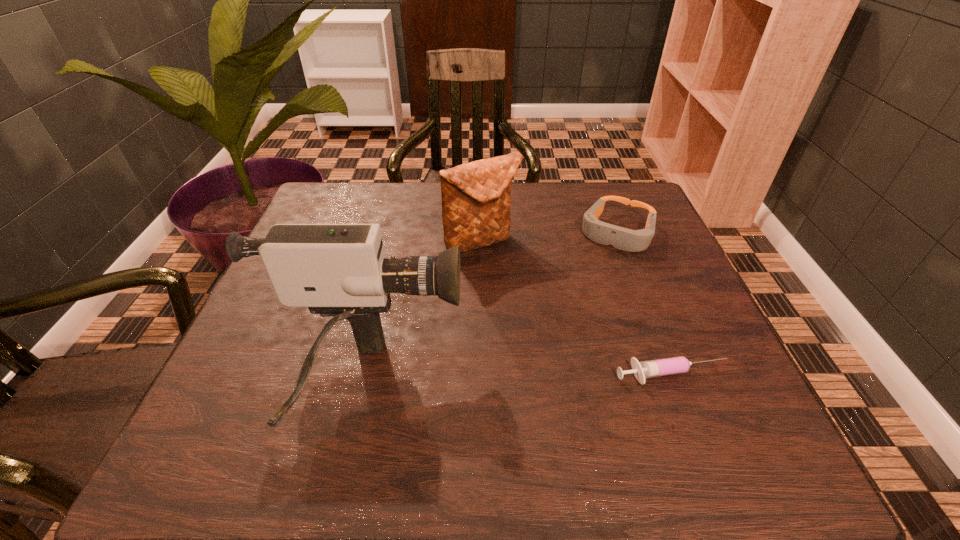
Where is `vacant space on the desktop that is between the camcorder and the syringe and is positioned on the open side of the clutch bag`? vacant space on the desktop that is between the camcorder and the syringe and is positioned on the open side of the clutch bag is located at coordinates 565,378.

This screenshot has width=960, height=540. Find the location of `vacant spot on the desktop that is between the camcorder and the syringe and is positioned on the front and back of the second shortest object`. vacant spot on the desktop that is between the camcorder and the syringe and is positioned on the front and back of the second shortest object is located at coordinates (544, 379).